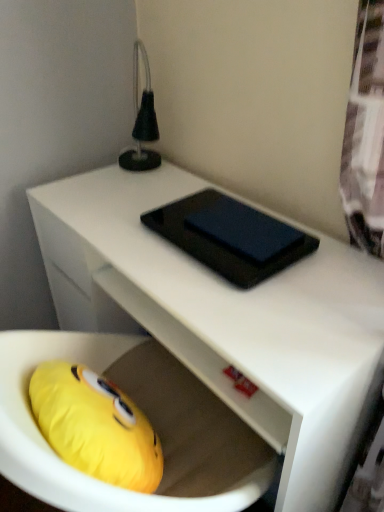
Question: Considering the positions of black glossy tablet at center and white matte desk at center in the image, is black glossy tablet at center bigger or smaller than white matte desk at center?

Choices:
 (A) small
 (B) big

Answer: (A)

Question: Relative to white matte desk at center, is black glossy tablet at center in front or behind?

Choices:
 (A) behind
 (B) front

Answer: (A)

Question: From a real-world perspective, is black glossy tablet at center physically located above or below white matte desk at center?

Choices:
 (A) below
 (B) above

Answer: (B)

Question: From the image's perspective, is white matte desk at center above or below black glossy tablet at center?

Choices:
 (A) below
 (B) above

Answer: (A)

Question: Do you think white matte desk at center is within black glossy tablet at center, or outside of it?

Choices:
 (A) inside
 (B) outside

Answer: (B)

Question: From a real-world perspective, is white matte desk at center positioned above or below black glossy tablet at center?

Choices:
 (A) above
 (B) below

Answer: (B)

Question: From their relative heights in the image, would you say white matte desk at center is taller or shorter than black glossy tablet at center?

Choices:
 (A) short
 (B) tall

Answer: (B)